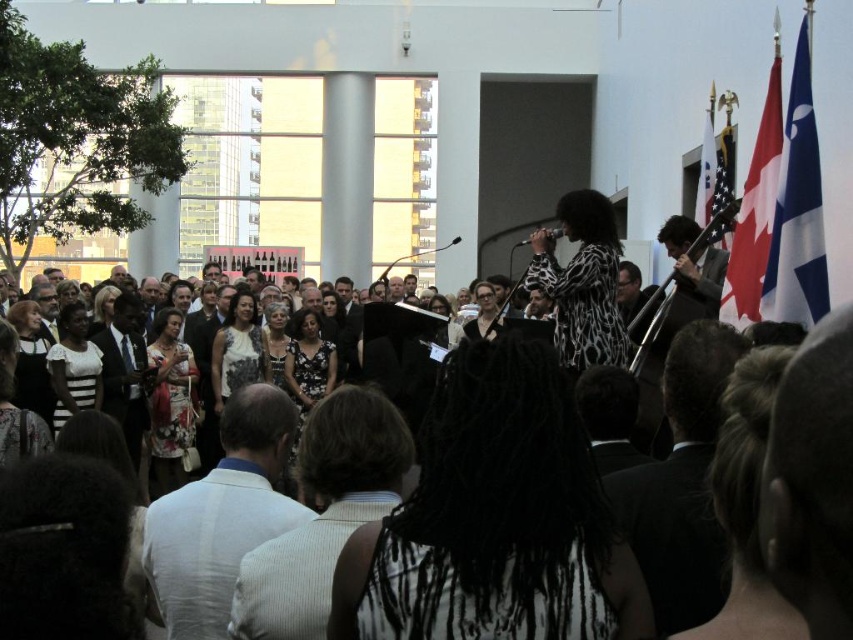
Question: Which of these objects is positioned farthest from the white lace dress at center?

Choices:
 (A) white textured hair at center
 (B) blue and white fabric flag at upper right
 (C) white dress at center

Answer: (B)

Question: Which of the following is the closest to the observer?

Choices:
 (A) (805, 211)
 (B) (300, 572)
 (C) (450, 404)

Answer: (B)

Question: Which point is farther to the camera?

Choices:
 (A) (367, 433)
 (B) (479, 300)
 (C) (711, 161)
 (D) (801, 304)

Answer: (B)

Question: Does white fabric flag at upper right appear under metallic silver necklace at center?

Choices:
 (A) yes
 (B) no

Answer: (B)

Question: Is white dress at center closer to camera compared to american flag at upper right?

Choices:
 (A) no
 (B) yes

Answer: (B)

Question: Where is black suit at center located in relation to red fabric flag at upper right in the image?

Choices:
 (A) right
 (B) left

Answer: (B)